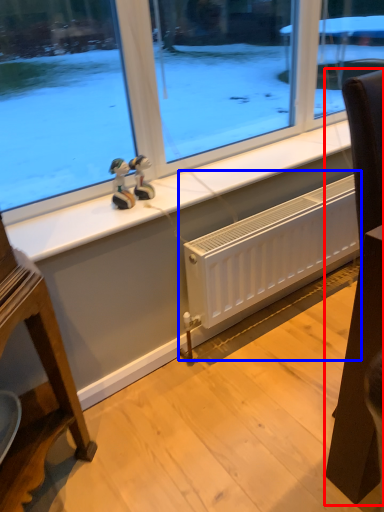
Question: Which object appears closest to the camera in this image, furniture (highlighted by a red box) or radiator (highlighted by a blue box)?

Choices:
 (A) furniture
 (B) radiator

Answer: (A)